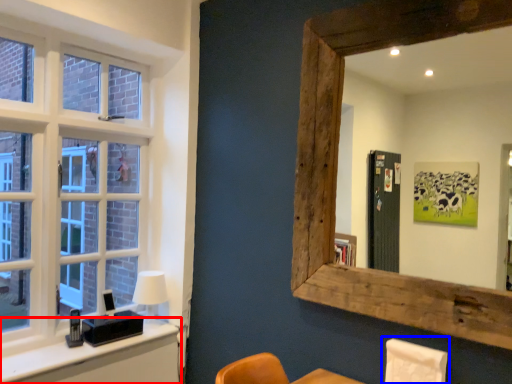
Question: Among these objects, which one is farthest to the camera, vanity (highlighted by a red box) or swivel chair (highlighted by a blue box)?

Choices:
 (A) vanity
 (B) swivel chair

Answer: (A)